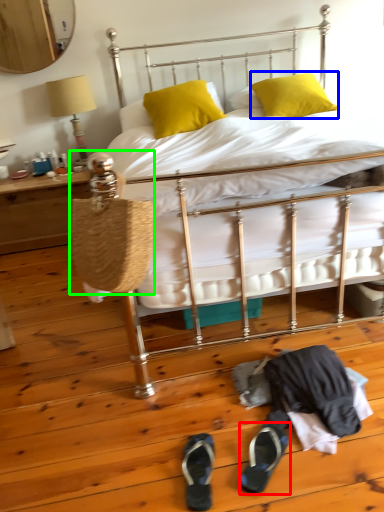
Question: Based on their relative distances, which object is farther from footwear (highlighted by a red box)? Choose from pillow (highlighted by a blue box) and handbag (highlighted by a green box).

Choices:
 (A) pillow
 (B) handbag

Answer: (A)